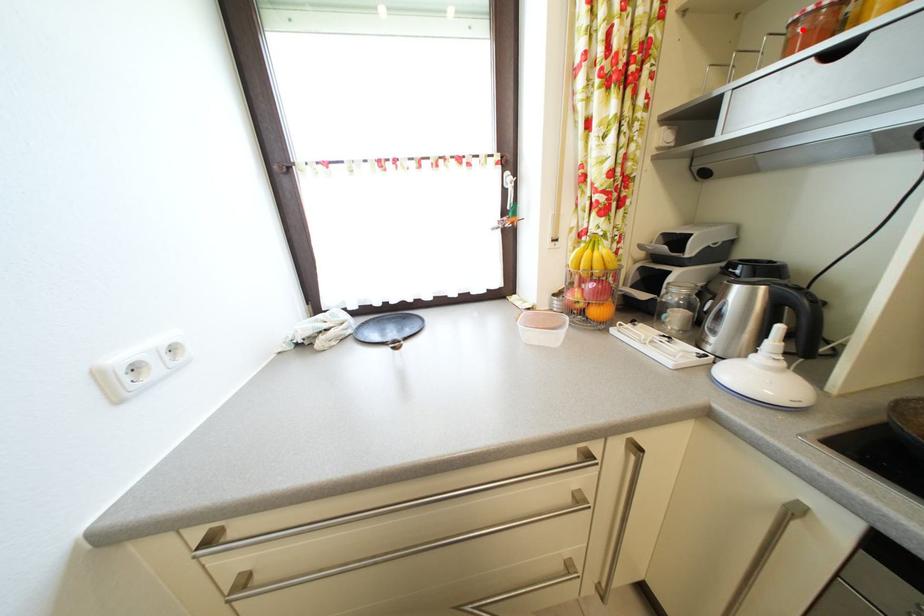
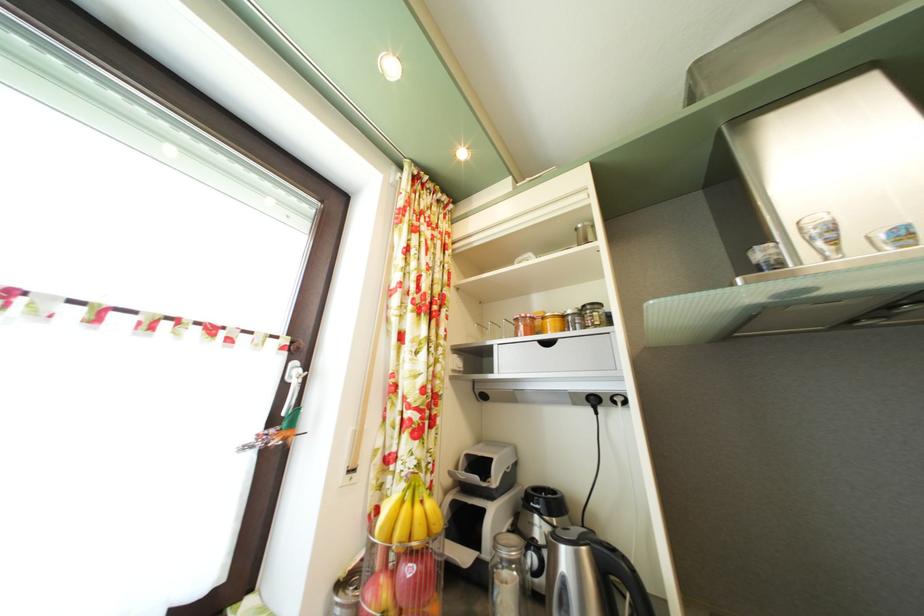
Find the pixel in the second image that matches the highlighted location in the first image.

(525, 326)